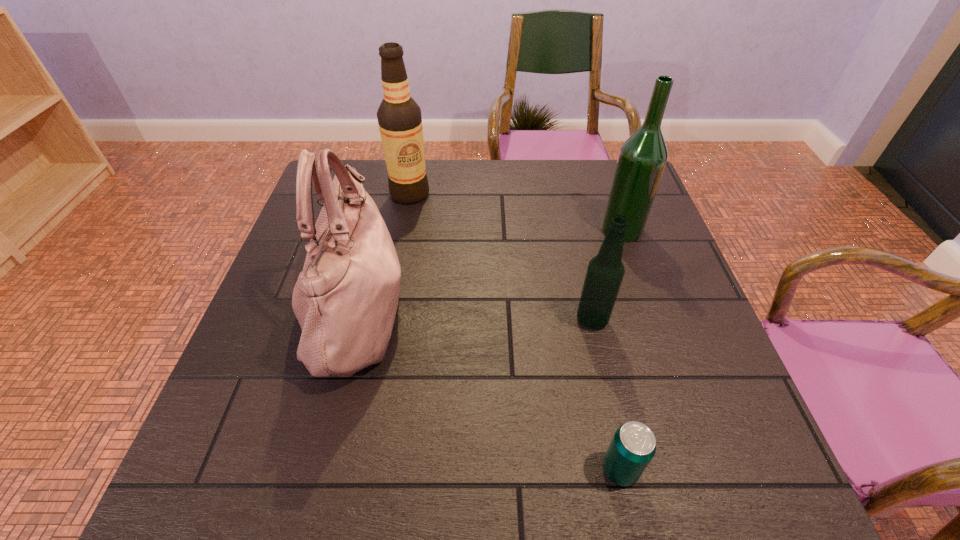
What are the coordinates of `free space that is in between the shortest object and the rightmost alcohol` in the screenshot? It's located at (621, 349).

Locate an element on the screen. free space that is in between the nearest alcohol and the beer can is located at coordinates (606, 395).

I want to click on vacant space that is in between the nearest object and the rightmost alcohol, so click(x=621, y=349).

Identify which object is the third closest to the handbag. Please provide its 2D coordinates. Your answer should be formatted as a tuple, i.e. [(x, y)], where the tuple contains the x and y coordinates of a point satisfying the conditions above.

[(633, 446)]

Identify the location of the closest object to the shortest alcohol. The height and width of the screenshot is (540, 960). (642, 158).

At what (x,y) coordinates should I click in order to perform the action: click on the closest alcohol to the second alcohol from left to right. Please return your answer as a coordinate pair (x, y). This screenshot has height=540, width=960. Looking at the image, I should click on (642, 158).

Locate which alcohol is the closest to the fourth tallest object. Please provide its 2D coordinates. Your answer should be formatted as a tuple, i.e. [(x, y)], where the tuple contains the x and y coordinates of a point satisfying the conditions above.

[(642, 158)]

This screenshot has height=540, width=960. Find the location of `free space that satisfies the following two spatial constraints: 1. on the label of the shortest object; 2. on the right side of the farthest object`. free space that satisfies the following two spatial constraints: 1. on the label of the shortest object; 2. on the right side of the farthest object is located at coordinates (359, 469).

Image resolution: width=960 pixels, height=540 pixels. I want to click on free space that satisfies the following two spatial constraints: 1. on the label of the second farthest object; 2. on the right side of the farthest alcohol, so click(403, 230).

The width and height of the screenshot is (960, 540). I want to click on free space that satisfies the following two spatial constraints: 1. at the front of the handbag with handles; 2. on the right side of the shortest object, so click(x=315, y=469).